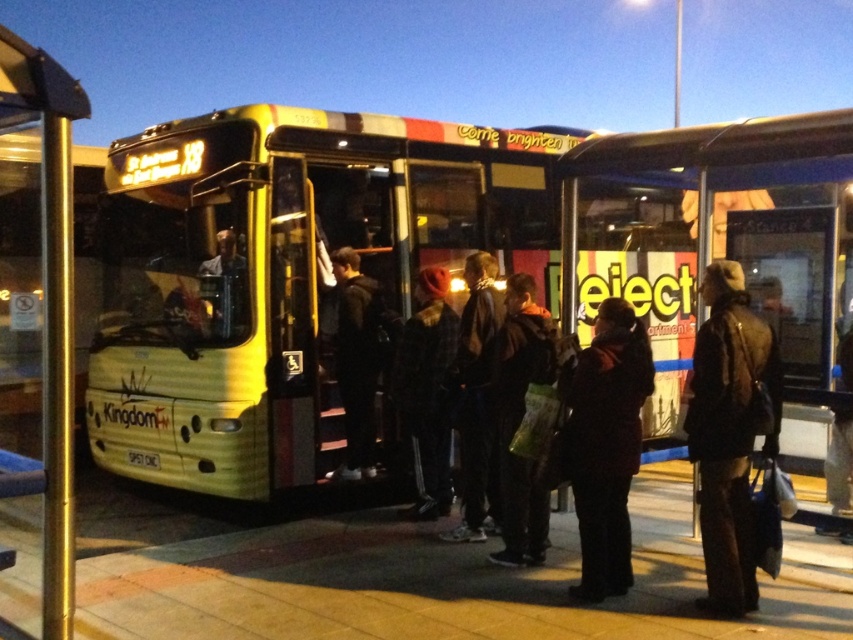
Question: Is yellow metallic bus at center above metallic gold pole at left?

Choices:
 (A) no
 (B) yes

Answer: (B)

Question: Which point is closer to the camera taking this photo?

Choices:
 (A) (766, 353)
 (B) (431, 253)
 (C) (589, 499)
 (D) (10, 67)

Answer: (D)

Question: Estimate the real-world distances between objects in this image. Which object is farther from the dark brown leather jacket at center?

Choices:
 (A) yellow metallic bus at center
 (B) metallic gold pole at left
 (C) dark wool coat at center

Answer: (A)

Question: Can you confirm if yellow metallic bus at center is positioned to the left of dark brown leather jacket at center?

Choices:
 (A) no
 (B) yes

Answer: (B)

Question: Considering the real-world distances, which object is closest to the dark wool coat at center?

Choices:
 (A) metallic gold pole at left
 (B) dark brown leather jacket at center

Answer: (B)

Question: Can you confirm if yellow metallic bus at center is bigger than metallic gold pole at left?

Choices:
 (A) yes
 (B) no

Answer: (A)